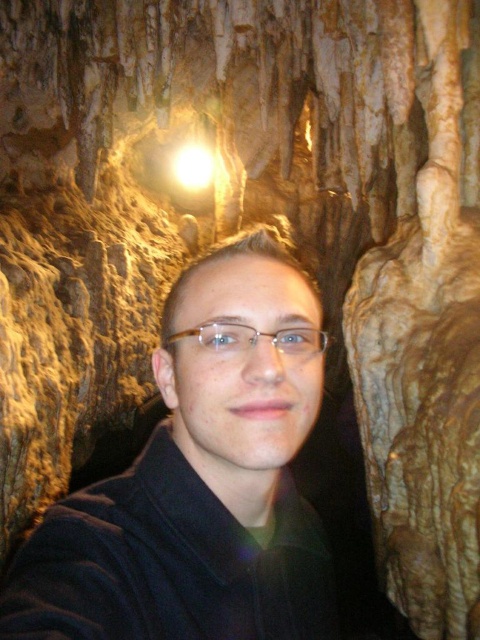
You are a spelunker exploring a cave and you have a 36 inch long flashlight. You see a point at coordinates point (x=294, y=600). Can your flashlight reach that point?

The point (x=294, y=600) is 37.05 inches away from the viewer, so the flashlight cannot reach it since it is 1.05 inches too short.

You are a spelunker navigating a cave. You see two points marked in the image. Which point is farther away from you, point (x=298, y=632) or point (x=196, y=336)?

Point (x=298, y=632) is behind point (x=196, y=336), so it is farther away from you.